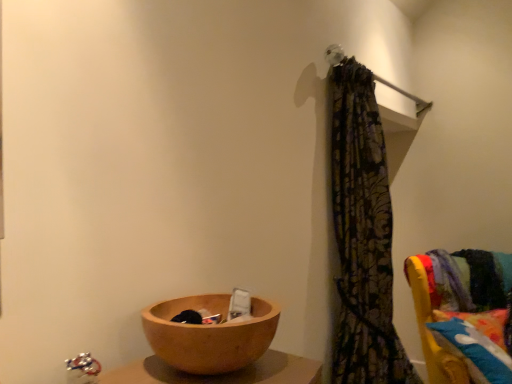
Question: Would you say patterned fabric curtain at upper right is to the left or to the right of velvet yellow chair at right in the picture?

Choices:
 (A) right
 (B) left

Answer: (B)

Question: Looking at the image, does patterned fabric curtain at upper right seem bigger or smaller compared to velvet yellow chair at right?

Choices:
 (A) big
 (B) small

Answer: (B)

Question: Estimate the real-world distances between objects in this image. Which object is closer to the patterned fabric curtain at upper right?

Choices:
 (A) velvet yellow chair at right
 (B) wooden bowl at lower left
 (C) fluffy multicolored pillow at right

Answer: (C)

Question: Which object is positioned farthest from the patterned fabric curtain at upper right?

Choices:
 (A) velvet yellow chair at right
 (B) fluffy multicolored pillow at right
 (C) wooden bowl at lower left

Answer: (C)